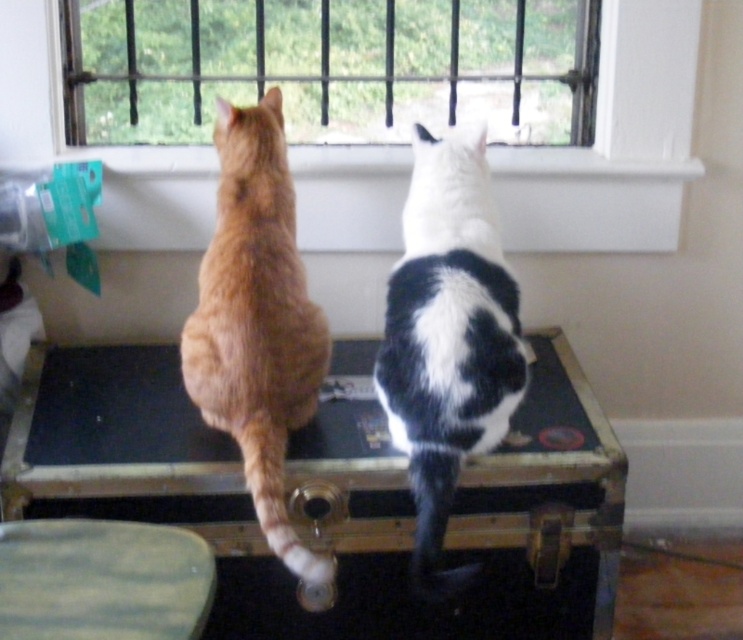
You are trying to place a small potted plant on the wooden stool at center and the white smooth window sill at upper center. Based on their sizes, which surface is more suitable for the plant?

The wooden stool at center is bigger than the white smooth window sill at upper center, so the wooden stool at center is more suitable for placing the small potted plant as it provides a larger and steadier surface.

You are a small toy that wants to move from the orange fur cat at center to the white smooth window sill at upper center. Can you fit on the window sill after moving there?

The white smooth window sill at upper center might be wider than orange fur cat at center, so there is a possibility that the toy can fit on the window sill after moving there.